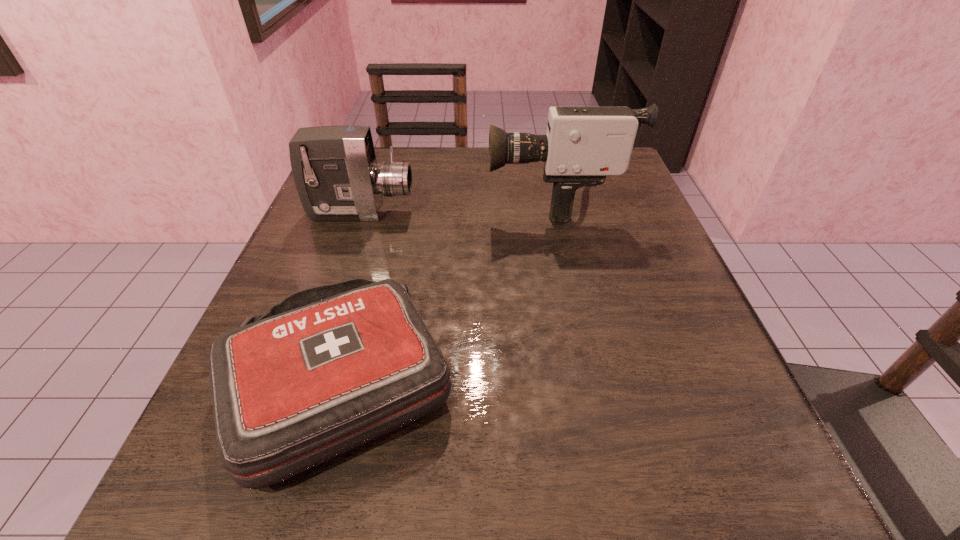
Locate an element on the screen. This screenshot has width=960, height=540. unoccupied position between the right camcorder and the first-aid kit is located at coordinates (448, 291).

The image size is (960, 540). What are the coordinates of `unoccupied area between the left camcorder and the rightmost object` in the screenshot? It's located at (458, 206).

Select which object appears as the closest to the shortest object. Please provide its 2D coordinates. Your answer should be formatted as a tuple, i.e. [(x, y)], where the tuple contains the x and y coordinates of a point satisfying the conditions above.

[(582, 145)]

You are a GUI agent. You are given a task and a screenshot of the screen. Output one action in this format:
    pyautogui.click(x=<x>, y=<y>)
    Task: Click on the second closest object to the first-aid kit
    The image size is (960, 540).
    Given the screenshot: What is the action you would take?
    (x=336, y=174)

What are the coordinates of `vacant space that satisfies the following two spatial constraints: 1. on the back side of the shortest object; 2. at the front of the second shortest object, highlighting the lens` in the screenshot? It's located at (387, 213).

This screenshot has height=540, width=960. I want to click on vacant region that satisfies the following two spatial constraints: 1. at the front of the nearest object, highlighting the lens; 2. on the right side of the second tallest object, so click(304, 381).

I want to click on vacant position in the image that satisfies the following two spatial constraints: 1. at the front of the shortest object, highlighting the lens; 2. on the left side of the shorter camcorder, so click(304, 381).